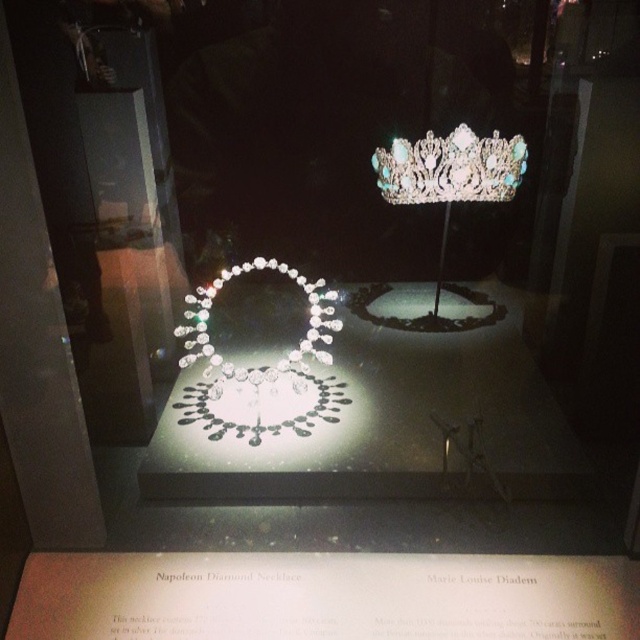
In the scene shown: You are an appraiser examining the display case and need to determine which piece of jewelry has a larger size between the clear crystal crown at upper center and the clear crystal necklace at center. Based on the description, which one is bigger?

The clear crystal necklace at center is larger in size compared to the clear crystal crown at upper center.

You are a jeweler who needs to clean both the clear crystal crown at upper center and the clear crystal necklace at center. The cleaning solution you have can only be applied to items within 20 inches of each other. Can you clean both items without moving them?

The clear crystal crown at upper center and the clear crystal necklace at center are 20.10 inches apart from each other. Since the distance exceeds the 20 inches limit, the cleaning solution cannot reach both items simultaneously without moving them.

You are a security guard inspecting the display case. You notice a suspicious object at point (451, 168). Based on the description, what is the object at that point?

The object at point (451, 168) is the clear crystal crown at upper center.